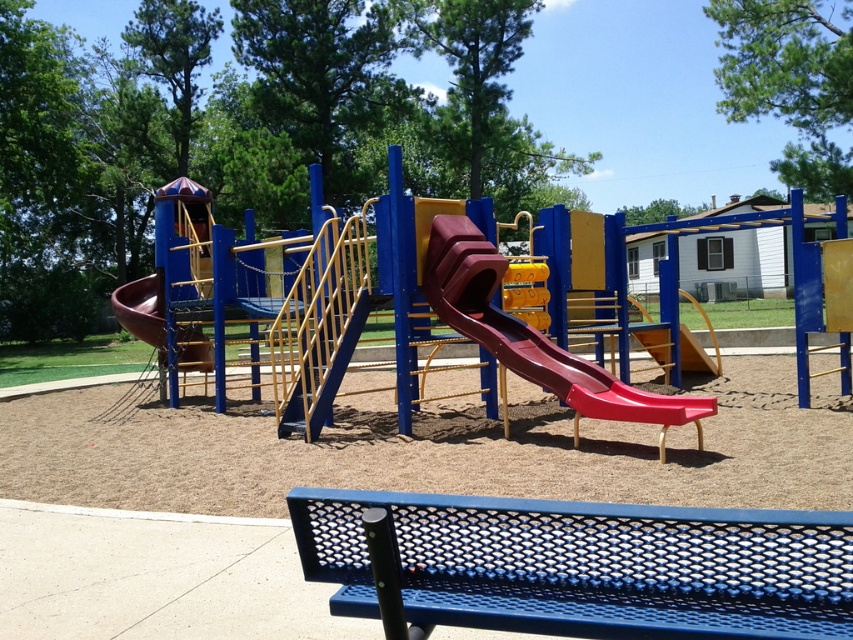
You are standing in the playground and want to know which of the two points, point [483,321] or point [202,348], is closer to you. Based on the scene, can you determine which point is nearer?

Point [483,321] is closer to the viewer than point [202,348].

You are a parent looking for a place to sit while watching your child play on the playground. The blue perforated metal bench at center and the rubberized smooth slide at center are both in your line of sight. Which object is closer to you?

The blue perforated metal bench at center is positioned under the rubberized smooth slide at center, meaning the bench is closer to you since it is beneath the slide.

You are a parent trying to decide where to sit while watching your child play on the playground. The blue perforated metal bench at center and the rubberized smooth slide at center are both in your line of sight. Which object is shorter in height?

The blue perforated metal bench at center is not as tall as the rubberized smooth slide at center, so the blue perforated metal bench at center is shorter in height.